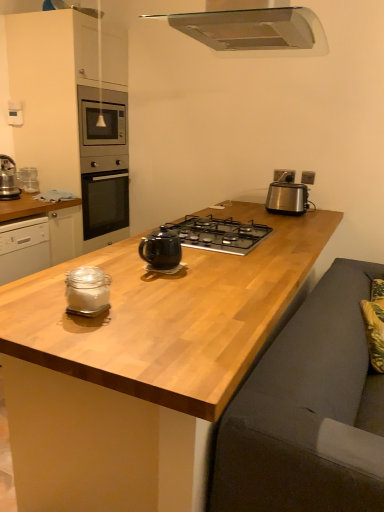
Where is `vacant position to the left of black glossy teapot at center`? Image resolution: width=384 pixels, height=512 pixels. vacant position to the left of black glossy teapot at center is located at coordinates (124, 264).